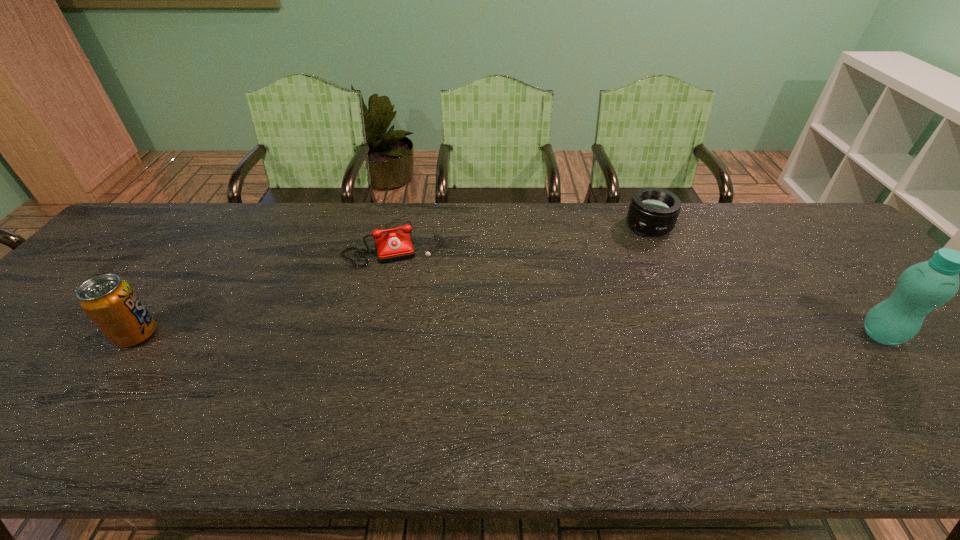
At what (x,y) coordinates should I click in order to perform the action: click on the third shortest object. Please return your answer as a coordinate pair (x, y). The width and height of the screenshot is (960, 540). Looking at the image, I should click on (110, 302).

Where is `the leftmost object`? the leftmost object is located at coordinates (110, 302).

You are a GUI agent. You are given a task and a screenshot of the screen. Output one action in this format:
    pyautogui.click(x=<x>, y=<y>)
    Task: Click on the bottle
    
    Given the screenshot: What is the action you would take?
    pyautogui.click(x=921, y=288)

Identify the location of the tallest object. The width and height of the screenshot is (960, 540). (921, 288).

What are the coordinates of `the third object from right to left` in the screenshot? It's located at (392, 246).

Find the location of `the shortest object`. the shortest object is located at coordinates (392, 246).

I want to click on telephoto lens, so click(653, 211).

What are the coordinates of `vacant space located on the back of the leftmost object` in the screenshot? It's located at (179, 276).

Image resolution: width=960 pixels, height=540 pixels. What are the coordinates of `vacant space situated 0.230m on the back of the rightmost object` in the screenshot? It's located at (818, 260).

I want to click on vacant region located 0.140m on the dial of the telephone, so click(x=413, y=302).